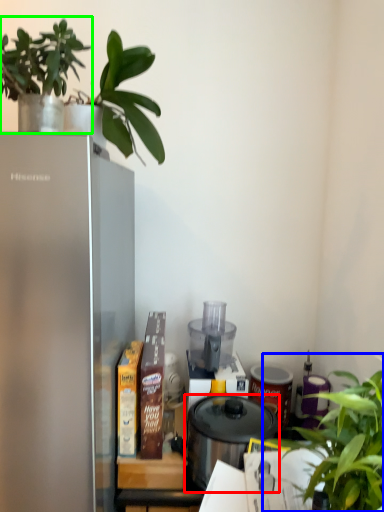
Question: Estimate the real-world distances between objects in this image. Which object is closer to pressure cooker (highlighted by a red box), houseplant (highlighted by a blue box) or houseplant (highlighted by a green box)?

Choices:
 (A) houseplant
 (B) houseplant

Answer: (A)